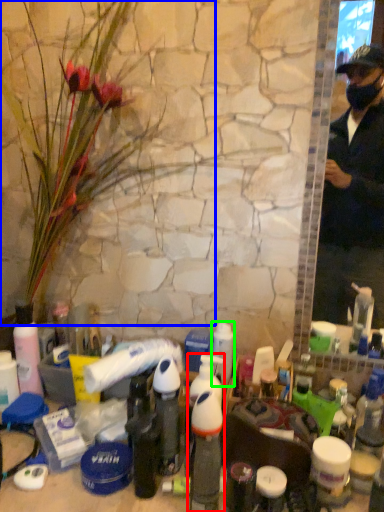
Question: Which object is positioned farthest from bottle (highlighted by a red box)? Select from flower (highlighted by a blue box) and toiletry (highlighted by a green box).

Choices:
 (A) flower
 (B) toiletry

Answer: (A)